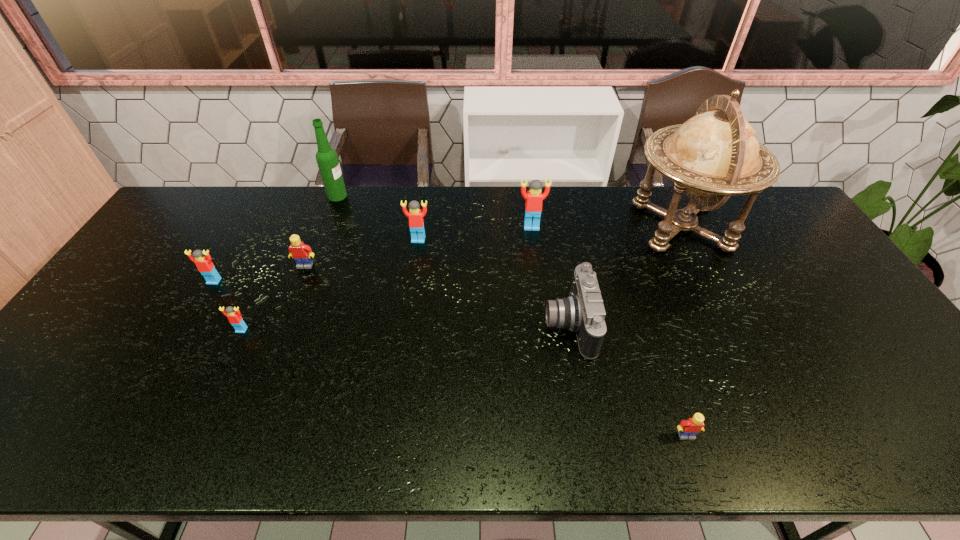
Identify the location of beer bottle located at the far edge. (326, 157).

Identify the location of Lego present at the far edge. (534, 197).

Where is `object at the near edge`? The image size is (960, 540). object at the near edge is located at coordinates (687, 429).

What are the coordinates of `free space at the far edge` in the screenshot? It's located at (656, 225).

In the image, there is a desktop. Where is `vacant space at the near edge`? Image resolution: width=960 pixels, height=540 pixels. vacant space at the near edge is located at coordinates (657, 426).

At what (x,y) coordinates should I click in order to perform the action: click on vacant space at the left edge of the desktop. Please return your answer as a coordinate pair (x, y). Image resolution: width=960 pixels, height=540 pixels. Looking at the image, I should click on (90, 383).

In the image, there is a desktop. Where is `vacant space at the far right corner`? The width and height of the screenshot is (960, 540). vacant space at the far right corner is located at coordinates (781, 222).

The width and height of the screenshot is (960, 540). I want to click on free spot between the rightmost Lego and the beer bottle, so click(512, 315).

Identify the location of free space that is in between the eighth shortest object and the smallest red Lego. The height and width of the screenshot is (540, 960). (290, 263).

You are a GUI agent. You are given a task and a screenshot of the screen. Output one action in this format:
    pyautogui.click(x=<x>, y=<y>)
    Task: Click on the vacant area that lies between the fifth nearest Lego and the eighth object from right to left
    The width and height of the screenshot is (960, 540).
    Given the screenshot: What is the action you would take?
    pyautogui.click(x=330, y=285)